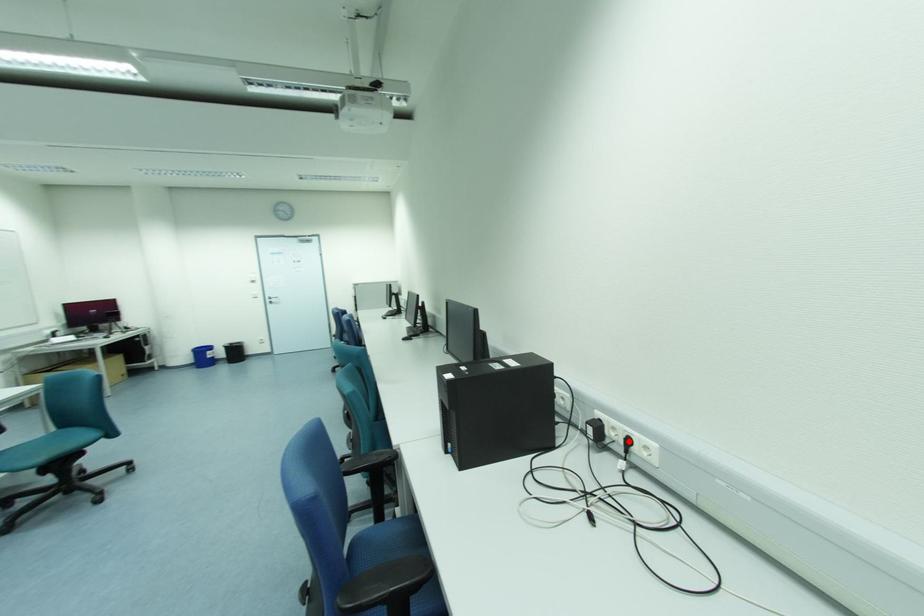
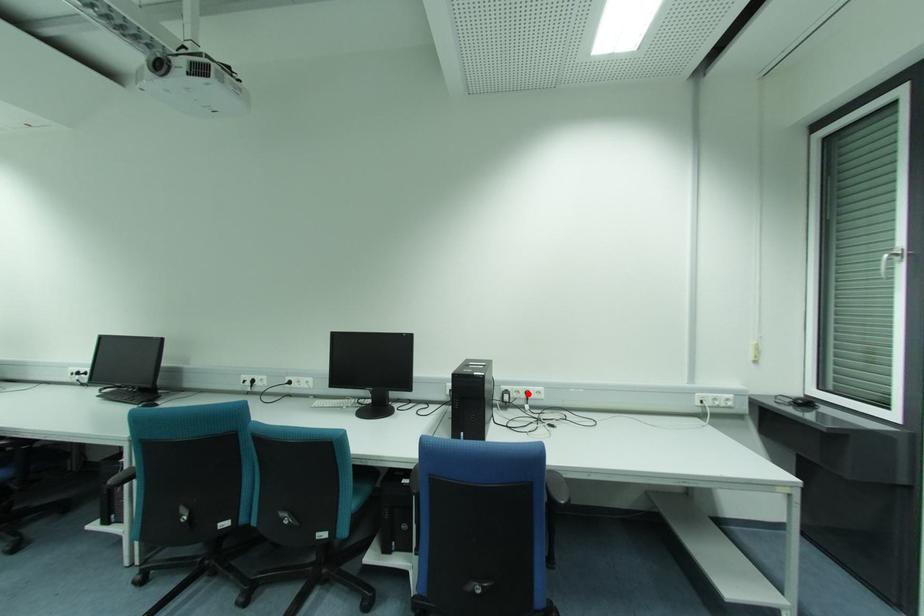
I am providing you with two images of the same scene from different viewpoints. A red point is marked on the first image and another point is marked on the second image. Are the points marked in image1 and image2 representing the same 3D position?

Yes